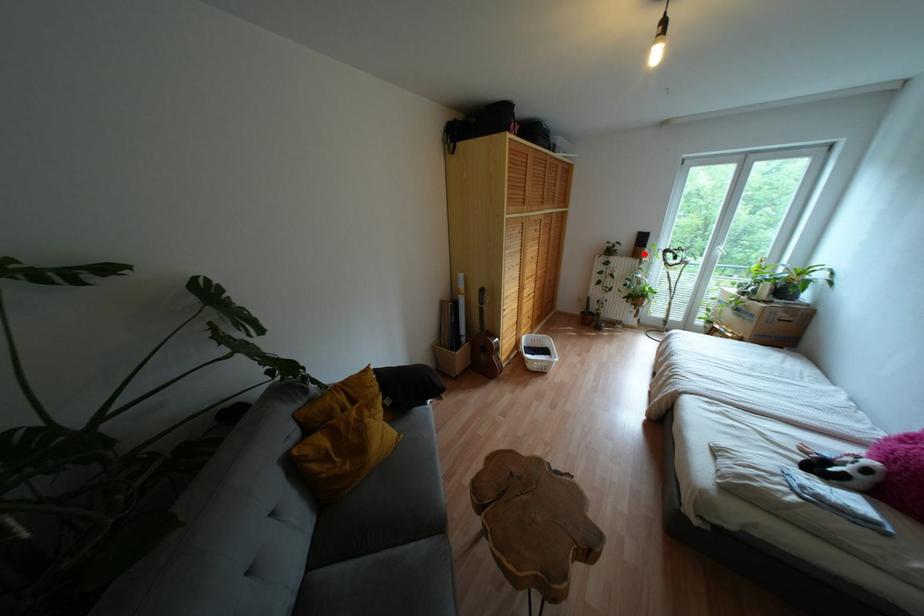
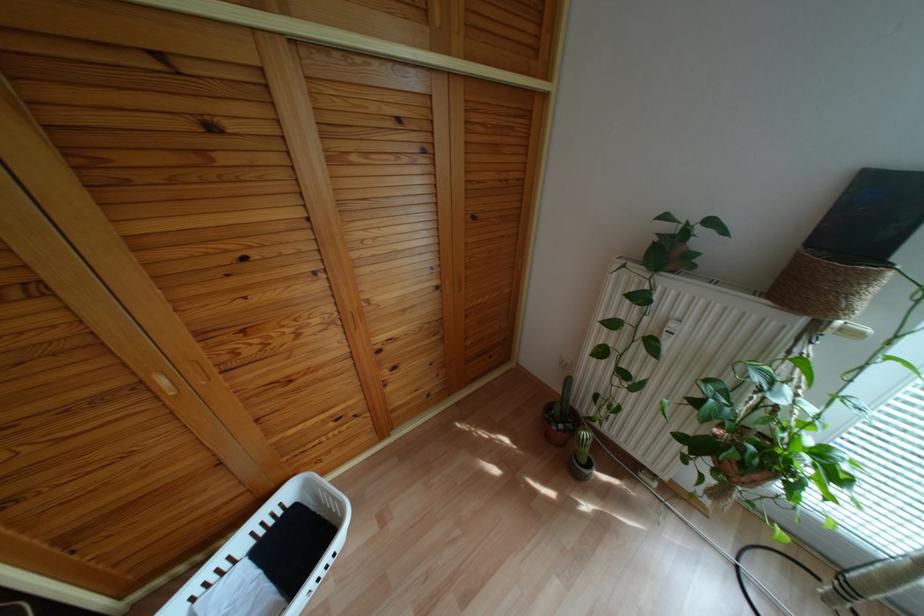
Question: I am providing you with two images of the same scene from different viewpoints. Image1 has a red point marked. In image2, the corresponding 3D location appears at what relative position? Reply with the corresponding letter.

Choices:
 (A) Closer
 (B) Farther

Answer: (B)